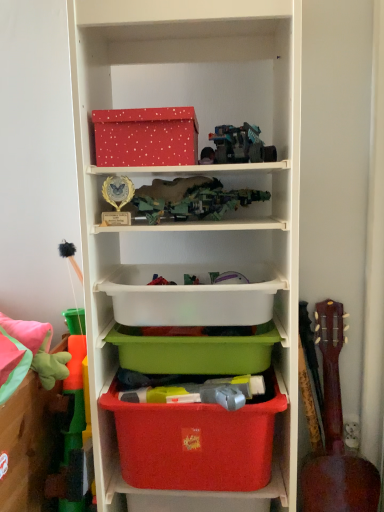
Question: Is matte plastic shelf at center in front of matte plastic storage box at left, the second storage box positioned from the bottom?

Choices:
 (A) no
 (B) yes

Answer: (A)

Question: Is matte plastic shelf at center to the right of matte plastic storage box at left, the third storage box positioned from the top, from the viewer's perspective?

Choices:
 (A) yes
 (B) no

Answer: (A)

Question: Considering the relative sizes of matte plastic shelf at center and matte plastic storage box at left, the third storage box positioned from the top, in the image provided, is matte plastic shelf at center thinner than matte plastic storage box at left, the third storage box positioned from the top,?

Choices:
 (A) no
 (B) yes

Answer: (A)

Question: Could matte plastic storage box at left, the third storage box positioned from the top, be considered to be inside matte plastic shelf at center?

Choices:
 (A) yes
 (B) no

Answer: (B)

Question: Considering the relative sizes of matte plastic shelf at center and matte plastic storage box at left, the second storage box positioned from the bottom, in the image provided, is matte plastic shelf at center bigger than matte plastic storage box at left, the second storage box positioned from the bottom,?

Choices:
 (A) no
 (B) yes

Answer: (B)

Question: Can you confirm if matte plastic shelf at center is smaller than matte plastic storage box at left, the second storage box positioned from the bottom?

Choices:
 (A) yes
 (B) no

Answer: (B)

Question: Is matte plastic storage box at lower center, which is counted as the fourth storage box, starting from the top, shorter than brown wooden guitar at right?

Choices:
 (A) yes
 (B) no

Answer: (A)

Question: Is matte plastic storage box at lower center, which is counted as the fourth storage box, starting from the top, far away from brown wooden guitar at right?

Choices:
 (A) yes
 (B) no

Answer: (B)

Question: Does matte plastic storage box at lower center, the 1th storage box positioned from the bottom, have a lesser width compared to brown wooden guitar at right?

Choices:
 (A) no
 (B) yes

Answer: (B)

Question: Is matte plastic storage box at lower center, the 1th storage box positioned from the bottom, closer to the viewer compared to brown wooden guitar at right?

Choices:
 (A) yes
 (B) no

Answer: (A)

Question: Considering the relative positions of matte plastic storage box at lower center, which is counted as the fourth storage box, starting from the top, and brown wooden guitar at right in the image provided, is matte plastic storage box at lower center, which is counted as the fourth storage box, starting from the top, to the right of brown wooden guitar at right from the viewer's perspective?

Choices:
 (A) yes
 (B) no

Answer: (B)

Question: Is matte plastic storage box at lower center, which is counted as the fourth storage box, starting from the top, oriented away from brown wooden guitar at right?

Choices:
 (A) yes
 (B) no

Answer: (B)

Question: Is matte plastic shelf at center positioned in front of red dotted cardboard box at upper center?

Choices:
 (A) yes
 (B) no

Answer: (A)